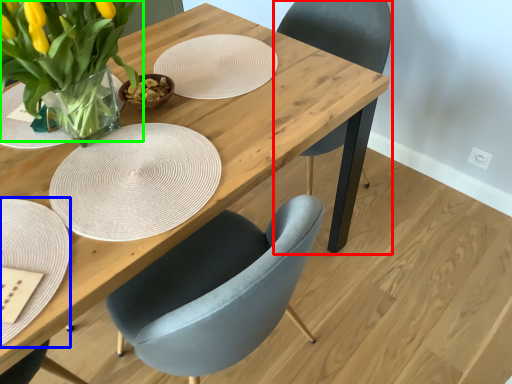
Question: Based on their relative distances, which object is nearer to chair (highlighted by a red box)? Choose from plate (highlighted by a blue box) and floral arrangement (highlighted by a green box).

Choices:
 (A) plate
 (B) floral arrangement

Answer: (B)